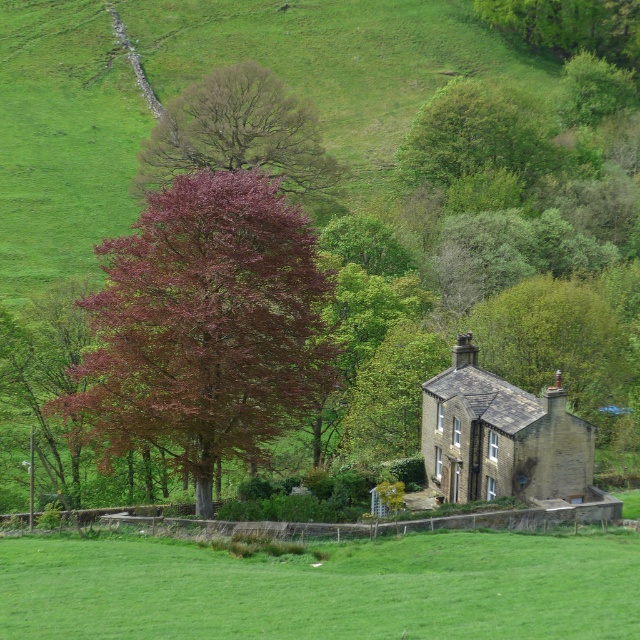
Question: Which point is farther to the camera?

Choices:
 (A) dark red leafy tree at upper left
 (B) green grass at lower center
 (C) brown stone cottage at center-right
 (D) smooth reddish-brown tree at upper center

Answer: (D)

Question: Which point appears closest to the camera in this image?

Choices:
 (A) (572, 474)
 (B) (161, 339)

Answer: (B)

Question: Does brown stone cottage at center-right appear on the right side of smooth reddish-brown tree at upper center?

Choices:
 (A) no
 (B) yes

Answer: (B)

Question: Can you confirm if dark red leafy tree at upper left is positioned above smooth reddish-brown tree at upper center?

Choices:
 (A) no
 (B) yes

Answer: (A)

Question: Can you confirm if green grass at lower center is positioned to the left of smooth reddish-brown tree at upper center?

Choices:
 (A) no
 (B) yes

Answer: (A)

Question: Among these objects, which one is farthest from the camera?

Choices:
 (A) brown stone cottage at center-right
 (B) dark red leafy tree at upper left

Answer: (A)